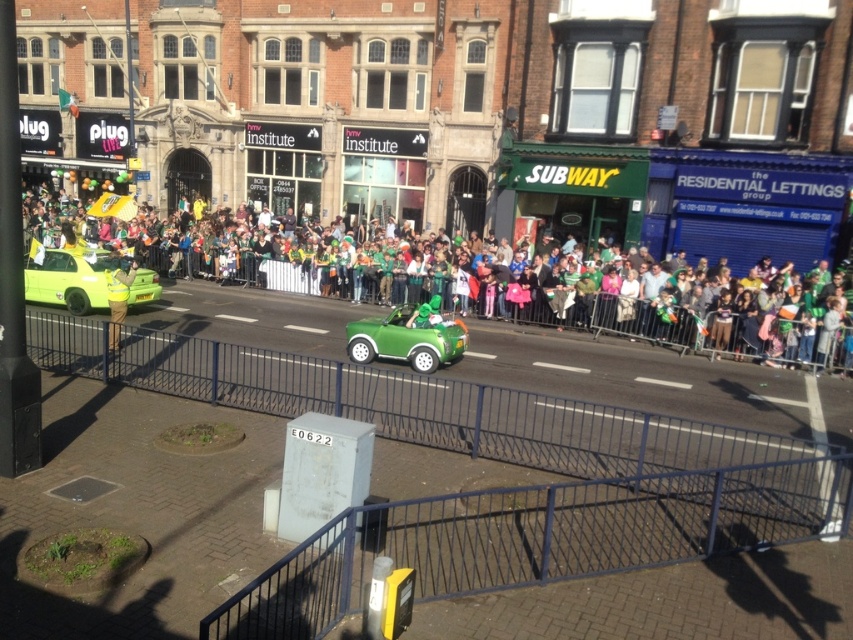
Is point (410, 356) farther from camera compared to point (67, 294)?

No, (410, 356) is in front of (67, 294).

Which of these two, green matte car at center or matte green car at left, stands shorter?

green matte car at center

Locate an element on the screen. The height and width of the screenshot is (640, 853). green matte car at center is located at coordinates (407, 337).

Is green matte car at center wider than yellow reflective vest at left?

Correct, the width of green matte car at center exceeds that of yellow reflective vest at left.

Between green matte car at center and yellow reflective vest at left, which one appears on the left side from the viewer's perspective?

yellow reflective vest at left is more to the left.

Locate an element on the screen. This screenshot has height=640, width=853. green matte car at center is located at coordinates (407, 337).

Based on the photo, who is lower down, green fabric crowd at center or green matte car at center?

Positioned lower is green matte car at center.

Which is more to the right, green fabric crowd at center or green matte car at center?

green matte car at center is more to the right.

Is point (378, 234) behind point (416, 320)?

Yes.

Image resolution: width=853 pixels, height=640 pixels. I want to click on green fabric crowd at center, so click(x=529, y=292).